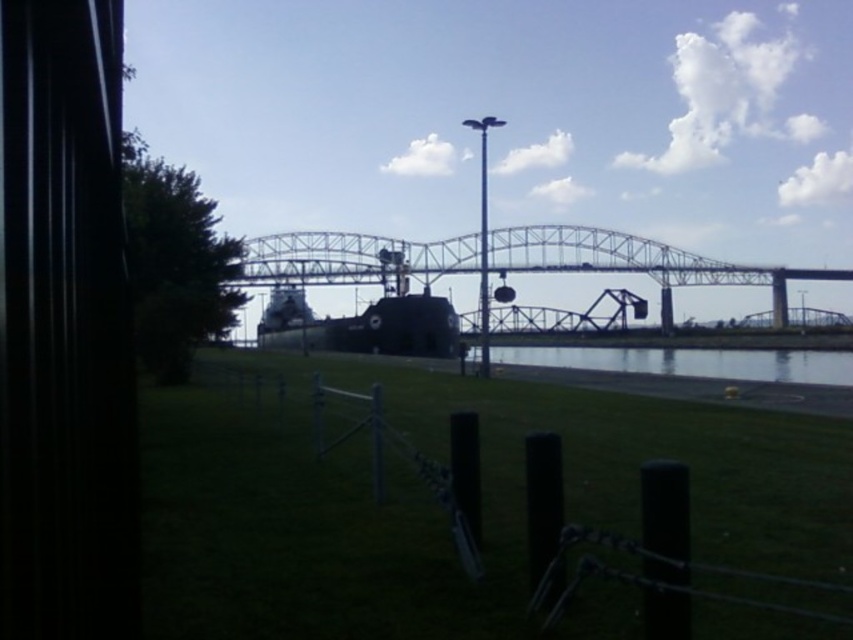
Does green grass at center appear under metallic gray bridge at center?

Yes.

Can you confirm if green grass at center is thinner than metallic gray bridge at center?

Yes.

Where is `green grass at center`? The height and width of the screenshot is (640, 853). green grass at center is located at coordinates (439, 506).

Between green grass at center and clear water at center, which one has less height?

green grass at center

Who is lower down, green grass at center or clear water at center?

clear water at center is below.

At what (x,y) coordinates should I click in order to perform the action: click on green grass at center. Please return your answer as a coordinate pair (x, y). This screenshot has width=853, height=640. Looking at the image, I should click on (439, 506).

The width and height of the screenshot is (853, 640). Identify the location of green grass at center. (439, 506).

Who is positioned more to the right, metallic gray bridge at center or clear water at center?

metallic gray bridge at center

Does metallic gray bridge at center have a greater height compared to clear water at center?

Yes.

Identify the location of metallic gray bridge at center. (502, 260).